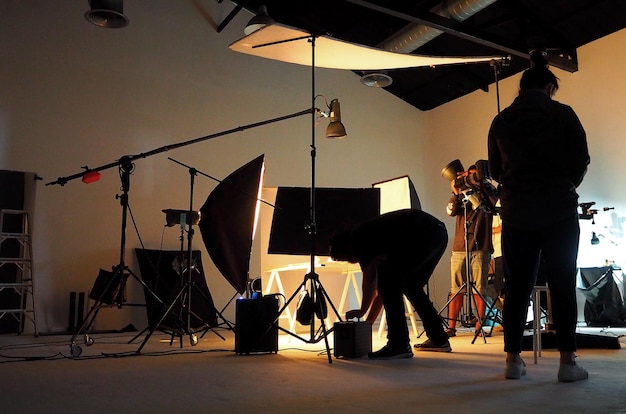
The image size is (626, 414). Identify the location of air conditioning ceiling pipe. (418, 40).